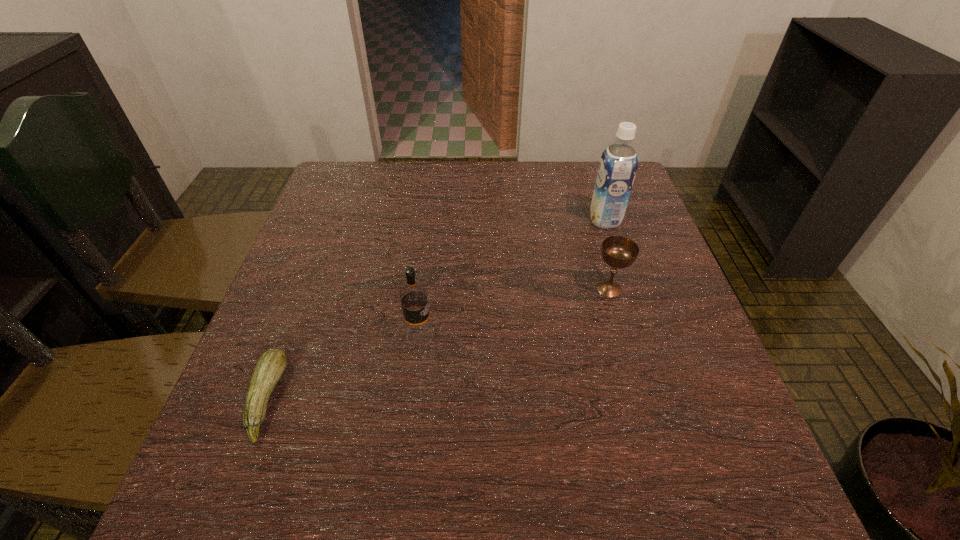
Where is `free location located on the label of the tallest object`? free location located on the label of the tallest object is located at coordinates (537, 220).

You are a GUI agent. You are given a task and a screenshot of the screen. Output one action in this format:
    pyautogui.click(x=<x>, y=<y>)
    Task: Click on the blank space located 0.380m on the label of the second tallest object
    
    Given the screenshot: What is the action you would take?
    pyautogui.click(x=624, y=336)

Locate an element on the screen. free spot located 0.150m on the back of the third tallest object is located at coordinates (593, 235).

Locate an element on the screen. This screenshot has width=960, height=540. vacant point located at the stem end of the nearest object is located at coordinates (308, 399).

Where is `object that is at the left edge`? This screenshot has width=960, height=540. object that is at the left edge is located at coordinates (271, 365).

The height and width of the screenshot is (540, 960). I want to click on soya milk at the right edge, so click(618, 164).

You are a GUI agent. You are given a task and a screenshot of the screen. Output one action in this format:
    pyautogui.click(x=<x>, y=<y>)
    Task: Click on the chalice present at the right edge
    
    Given the screenshot: What is the action you would take?
    pyautogui.click(x=619, y=252)

What are the coordinates of `free space at the far edge` in the screenshot? It's located at (437, 184).

Where is `vacant space at the near edge of the desktop`? vacant space at the near edge of the desktop is located at coordinates (361, 500).

Image resolution: width=960 pixels, height=540 pixels. What are the coordinates of `free space at the left edge of the desktop` in the screenshot? It's located at (356, 213).